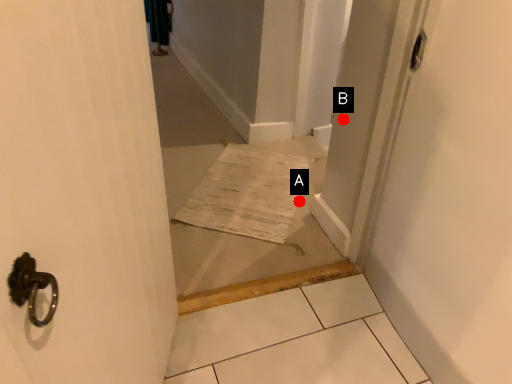
Question: Two points are circled on the image, labeled by A and B beside each circle. Which point appears closest to the camera in this image?

Choices:
 (A) A is closer
 (B) B is closer

Answer: (B)